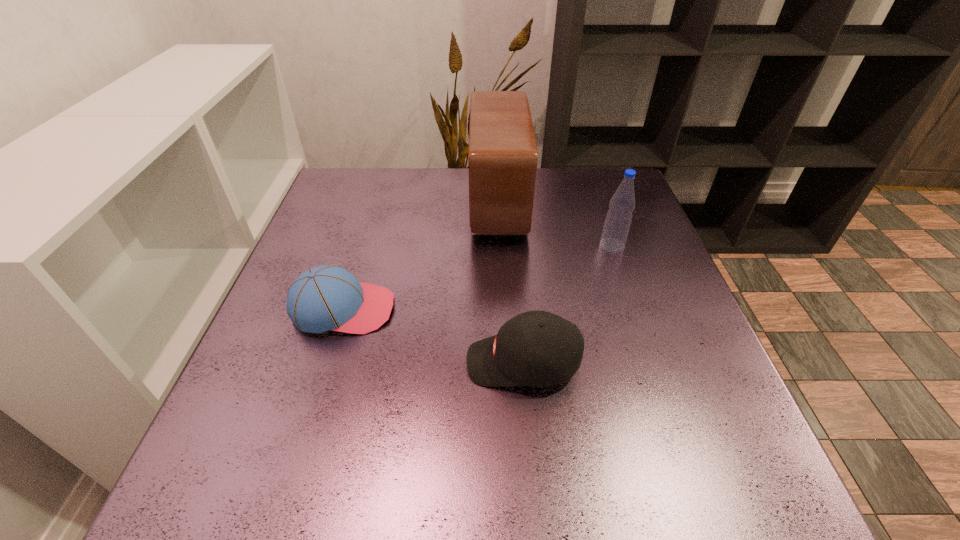
Locate an element on the screen. The image size is (960, 540). free spot located with a logo on the front of the right baseball cap is located at coordinates (308, 362).

At what (x,y) coordinates should I click in order to perform the action: click on vacant space located 0.350m with a logo on the front of the right baseball cap. Please return your answer as a coordinate pair (x, y). Looking at the image, I should click on (276, 362).

Where is `vacant space located 0.100m on the front-facing side of the leftmost object`? vacant space located 0.100m on the front-facing side of the leftmost object is located at coordinates (443, 309).

The height and width of the screenshot is (540, 960). What are the coordinates of `object located at the far edge` in the screenshot? It's located at (503, 156).

At what (x,y) coordinates should I click in order to perform the action: click on object that is at the left edge. Please return your answer as a coordinate pair (x, y). This screenshot has height=540, width=960. Looking at the image, I should click on (323, 298).

Locate an element on the screen. This screenshot has height=540, width=960. object that is positioned at the right edge is located at coordinates (619, 216).

Locate an element on the screen. The image size is (960, 540). vacant space at the far edge is located at coordinates (434, 178).

Identify the location of free location at the near edge. The height and width of the screenshot is (540, 960). (325, 484).

You are a GUI agent. You are given a task and a screenshot of the screen. Output one action in this format:
    pyautogui.click(x=<x>, y=<y>)
    Task: Click on the free space at the left edge of the desktop
    The height and width of the screenshot is (540, 960).
    Given the screenshot: What is the action you would take?
    pyautogui.click(x=360, y=225)

This screenshot has width=960, height=540. In the image, there is a desktop. In order to click on vacant space at the right edge in this screenshot , I will do `click(659, 297)`.